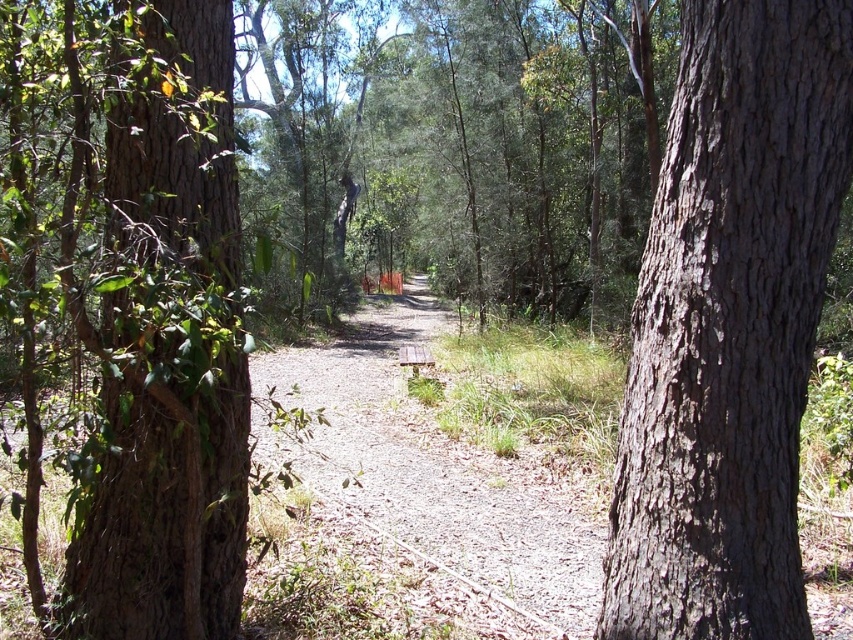
Question: Which point is closer to the camera taking this photo?

Choices:
 (A) (428, 362)
 (B) (787, 502)
 (C) (408, 337)

Answer: (B)

Question: Can you confirm if brown rough bark tree at left is wider than brown gravel path at center?

Choices:
 (A) yes
 (B) no

Answer: (B)

Question: Can you confirm if brown rough bark tree at left is positioned to the right of wooden bench at center?

Choices:
 (A) no
 (B) yes

Answer: (A)

Question: Is brown rough bark tree at left positioned before wooden bench at center?

Choices:
 (A) no
 (B) yes

Answer: (B)

Question: Which point is farther to the camera?

Choices:
 (A) (409, 356)
 (B) (753, 6)

Answer: (A)

Question: Which point is closer to the camera taking this photo?

Choices:
 (A) (426, 364)
 (B) (115, 454)
 (C) (717, 92)
 (D) (518, 497)

Answer: (B)